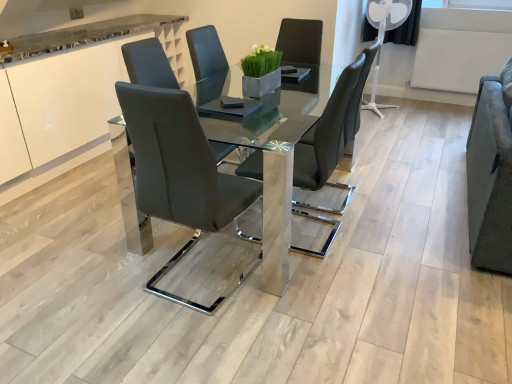
Question: Is matte black chair at center, placed as the 1th chair when sorted from right to left, thinner than white glossy cabinet at upper left?

Choices:
 (A) no
 (B) yes

Answer: (B)

Question: Is white glossy cabinet at upper left at the back of matte black chair at center, placed as the 1th chair when sorted from right to left?

Choices:
 (A) no
 (B) yes

Answer: (A)

Question: Are matte black chair at center, which is the 2th chair from left to right, and white glossy cabinet at upper left making contact?

Choices:
 (A) yes
 (B) no

Answer: (B)

Question: From the image's perspective, would you say matte black chair at center, which is the 2th chair from left to right, is shown under white glossy cabinet at upper left?

Choices:
 (A) yes
 (B) no

Answer: (A)

Question: Are matte black chair at center, which is the 2th chair from left to right, and white glossy cabinet at upper left far apart?

Choices:
 (A) no
 (B) yes

Answer: (B)

Question: From the image's perspective, would you say matte black chair at center, placed as the 1th chair when sorted from right to left, is positioned over white glossy cabinet at upper left?

Choices:
 (A) no
 (B) yes

Answer: (A)

Question: From a real-world perspective, is white glossy cabinet at upper left on top of matte black chair at center, which is the 2th chair from left to right?

Choices:
 (A) yes
 (B) no

Answer: (B)

Question: From a real-world perspective, is white glossy cabinet at upper left under matte black chair at center, placed as the 1th chair when sorted from right to left?

Choices:
 (A) yes
 (B) no

Answer: (A)

Question: Can you confirm if white glossy cabinet at upper left is shorter than matte black chair at center, placed as the 1th chair when sorted from right to left?

Choices:
 (A) no
 (B) yes

Answer: (B)

Question: Would you say white glossy cabinet at upper left is a long distance from matte black chair at center, which is the 2th chair from left to right?

Choices:
 (A) no
 (B) yes

Answer: (B)

Question: Can you confirm if white glossy cabinet at upper left is taller than matte black chair at center, placed as the 1th chair when sorted from right to left?

Choices:
 (A) no
 (B) yes

Answer: (A)

Question: Is white glossy cabinet at upper left facing towards matte black chair at center, placed as the 1th chair when sorted from right to left?

Choices:
 (A) yes
 (B) no

Answer: (A)

Question: Can you confirm if matte black chair at center, the 1th chair positioned from the left, is thinner than velvet grey armchair at right?

Choices:
 (A) yes
 (B) no

Answer: (B)